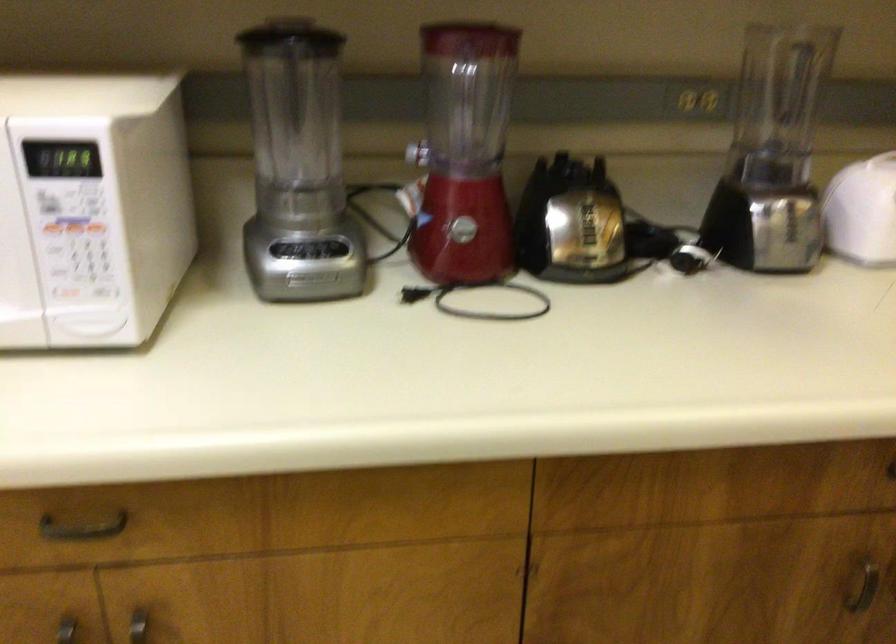
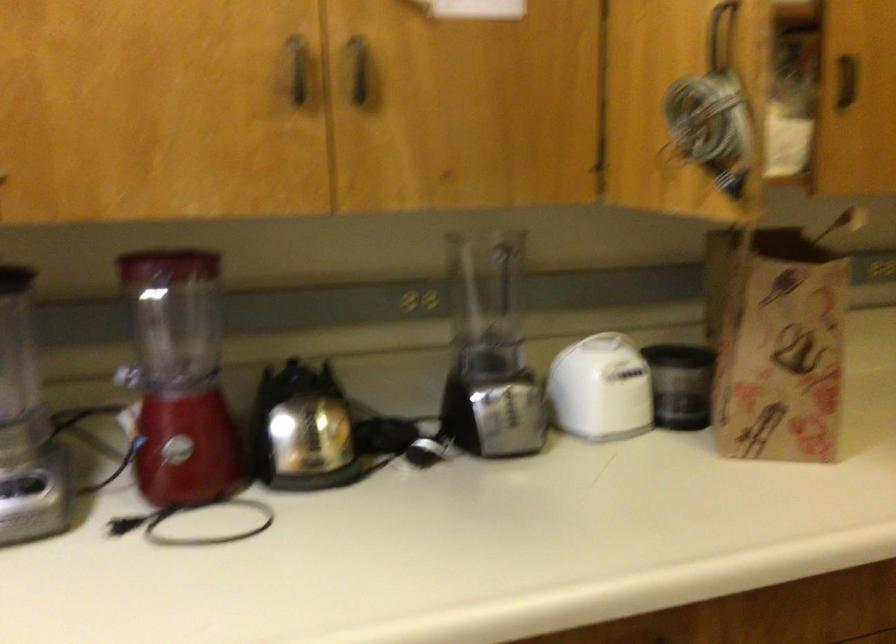
In the second image, find the point that corresponds to point 773,156 in the first image.

(489, 351)